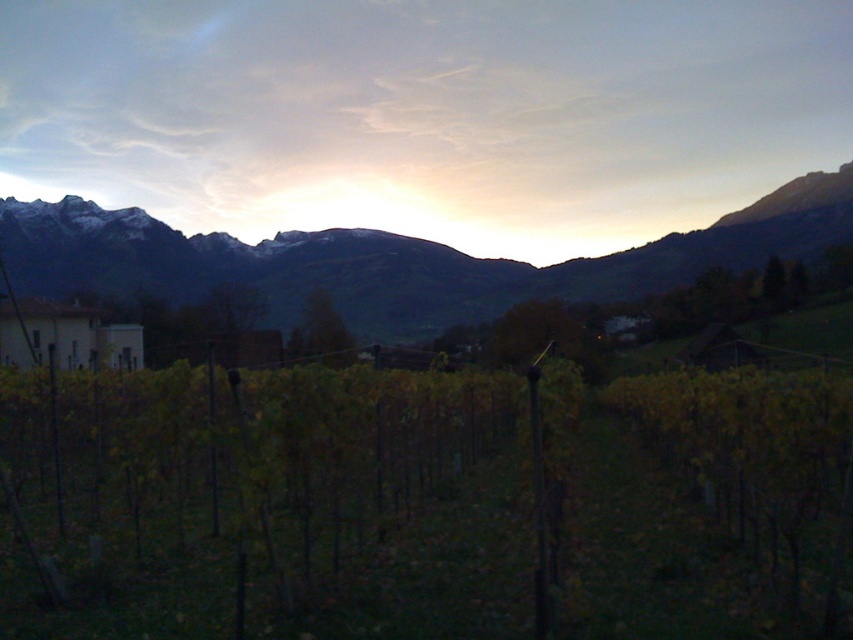
Between green leafy vineyard at center and rocky brown mountain range at center, which one has less height?

Standing shorter between the two is green leafy vineyard at center.

Which of these two, green leafy vineyard at center or rocky brown mountain range at center, stands taller?

rocky brown mountain range at center

Who is more distant from viewer, (331,582) or (440,301)?

The point (440,301) is behind.

Image resolution: width=853 pixels, height=640 pixels. Identify the location of green leafy vineyard at center. (424, 504).